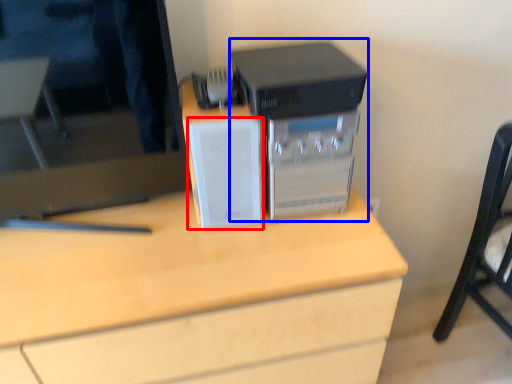
Question: Which of the following is the farthest to the observer, speaker (highlighted by a red box) or home appliance (highlighted by a blue box)?

Choices:
 (A) speaker
 (B) home appliance

Answer: (B)